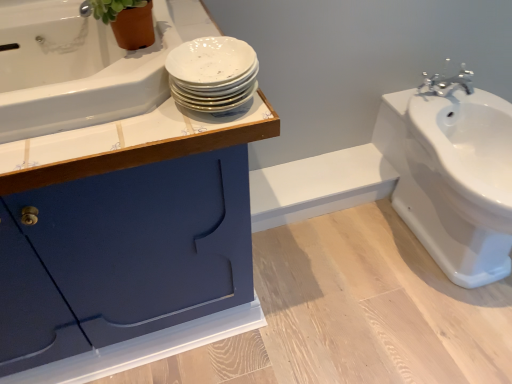
Question: Is green matte plant at upper left surrounding white glossy sink at right?

Choices:
 (A) yes
 (B) no

Answer: (B)

Question: Is green matte plant at upper left thinner than white glossy sink at right?

Choices:
 (A) no
 (B) yes

Answer: (B)

Question: From the image's perspective, is green matte plant at upper left beneath white glossy sink at right?

Choices:
 (A) yes
 (B) no

Answer: (B)

Question: Is green matte plant at upper left facing away from white glossy sink at right?

Choices:
 (A) no
 (B) yes

Answer: (A)

Question: Is green matte plant at upper left aimed at white glossy sink at right?

Choices:
 (A) no
 (B) yes

Answer: (A)

Question: Does green matte plant at upper left come in front of white glossy sink at right?

Choices:
 (A) yes
 (B) no

Answer: (A)

Question: Are matte blue cabinet at upper left and white glossy bathtub at upper left making contact?

Choices:
 (A) no
 (B) yes

Answer: (A)

Question: Considering the relative sizes of matte blue cabinet at upper left and white glossy bathtub at upper left in the image provided, is matte blue cabinet at upper left wider than white glossy bathtub at upper left?

Choices:
 (A) no
 (B) yes

Answer: (B)

Question: Is the position of matte blue cabinet at upper left more distant than that of white glossy bathtub at upper left?

Choices:
 (A) no
 (B) yes

Answer: (B)

Question: From a real-world perspective, is matte blue cabinet at upper left on top of white glossy bathtub at upper left?

Choices:
 (A) yes
 (B) no

Answer: (B)

Question: Can you confirm if matte blue cabinet at upper left is shorter than white glossy bathtub at upper left?

Choices:
 (A) no
 (B) yes

Answer: (A)

Question: From a real-world perspective, is matte blue cabinet at upper left physically below white glossy bathtub at upper left?

Choices:
 (A) no
 (B) yes

Answer: (B)

Question: From a real-world perspective, does white glossy bathtub at upper left stand above green matte plant at upper left?

Choices:
 (A) no
 (B) yes

Answer: (A)